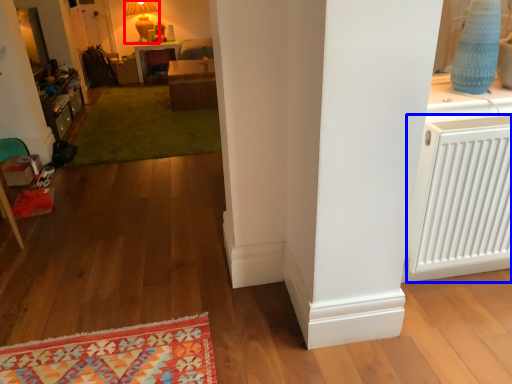
Question: Which object is further to the camera taking this photo, lamp (highlighted by a red box) or air conditioning (highlighted by a blue box)?

Choices:
 (A) lamp
 (B) air conditioning

Answer: (A)